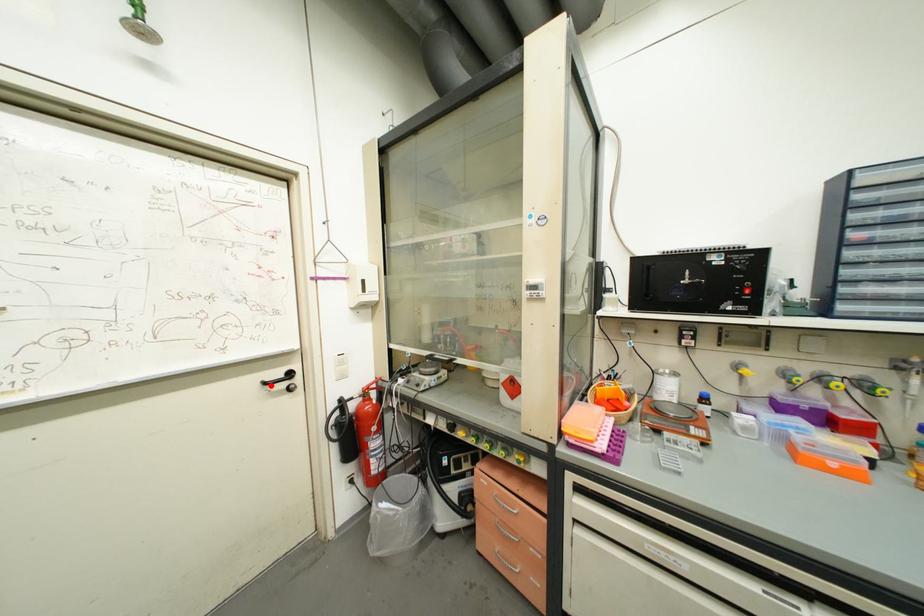
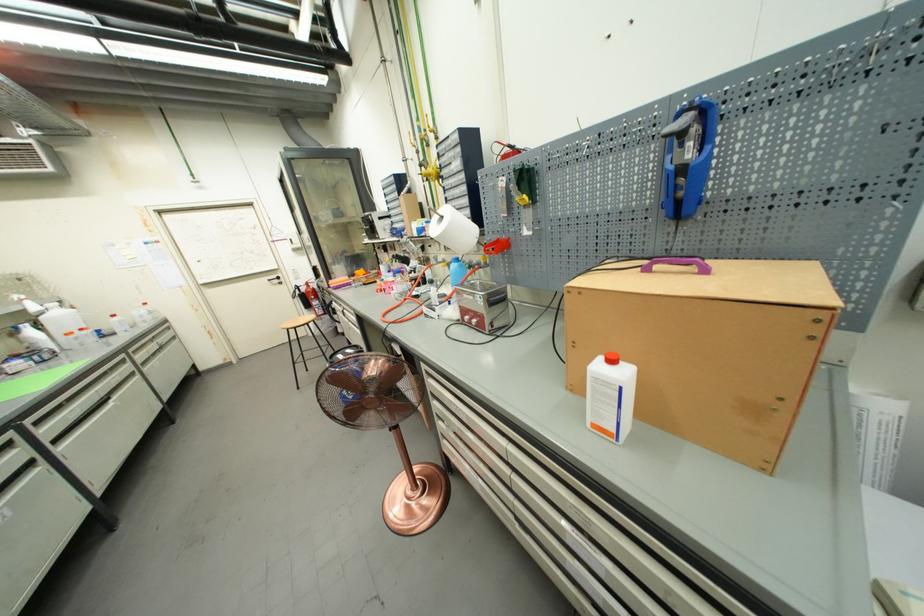
In the second image, find the point that corresponds to the highlighted location in the first image.

(274, 282)